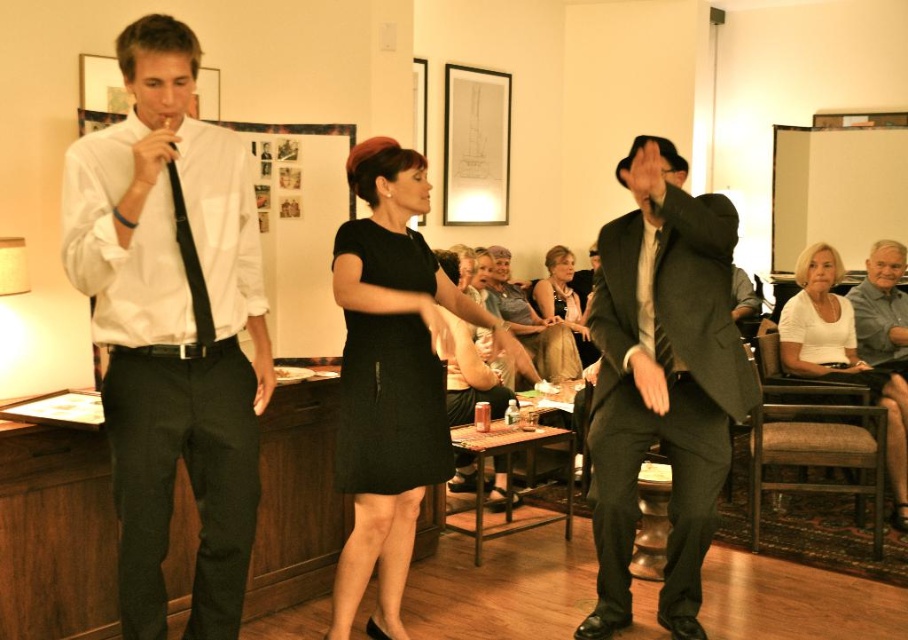
How far apart are the young man in white shirt and the black matte dress at center?

The young man in white shirt and the black matte dress at center are 8.92 feet apart.

Based on the scene description, which object is taller between the black matte dress at center and the black satin tie at left?

The black matte dress at center is taller than the black satin tie at left according to the description.

You are standing in the room and want to hand a flower to the matte black tie at left. Can you reach it without moving closer than 1.8 meters?

The matte black tie at left is 1.90 meters away from the viewer. Since you need to stay at least 1.8 meters away, you can reach it as the distance is within your limit.